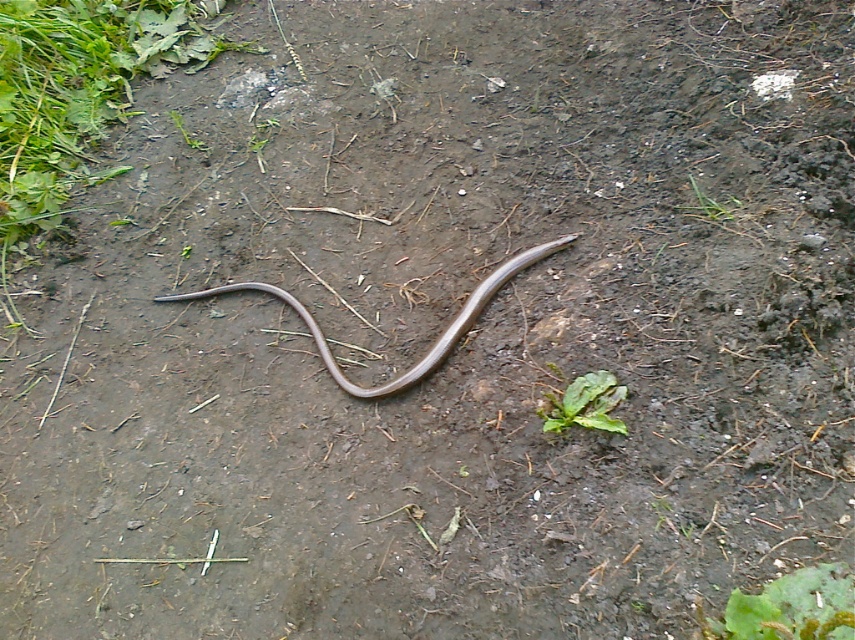
Question: Among these points, which one is farthest from the camera?

Choices:
 (A) (473, 310)
 (B) (581, 413)

Answer: (A)

Question: Which object appears closest to the camera in this image?

Choices:
 (A) green leafy plant at center
 (B) brown matte snake at center

Answer: (A)

Question: Considering the relative positions of brown matte snake at center and green leafy plant at center in the image provided, where is brown matte snake at center located with respect to green leafy plant at center?

Choices:
 (A) below
 (B) above

Answer: (B)

Question: Is brown matte snake at center bigger than green leafy plant at center?

Choices:
 (A) no
 (B) yes

Answer: (B)

Question: Is brown matte snake at center above green leafy plant at center?

Choices:
 (A) no
 (B) yes

Answer: (B)